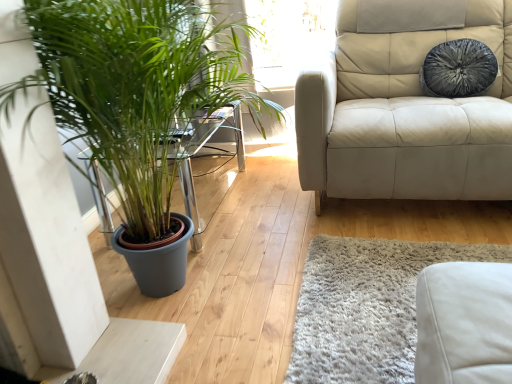
Question: Is green matte plant at left inside or outside of velvety gray pillow at upper right?

Choices:
 (A) outside
 (B) inside

Answer: (A)

Question: Based on their positions, is green matte plant at left located to the left or right of velvety gray pillow at upper right?

Choices:
 (A) right
 (B) left

Answer: (B)

Question: From the image's perspective, relative to velvety gray pillow at upper right, is green matte plant at left above or below?

Choices:
 (A) above
 (B) below

Answer: (B)

Question: From the image's perspective, is velvety gray pillow at upper right positioned above or below green matte plant at left?

Choices:
 (A) above
 (B) below

Answer: (A)

Question: From a real-world perspective, is velvety gray pillow at upper right above or below green matte plant at left?

Choices:
 (A) above
 (B) below

Answer: (A)

Question: Is velvety gray pillow at upper right bigger or smaller than green matte plant at left?

Choices:
 (A) small
 (B) big

Answer: (A)

Question: In terms of width, does velvety gray pillow at upper right look wider or thinner when compared to green matte plant at left?

Choices:
 (A) thin
 (B) wide

Answer: (A)